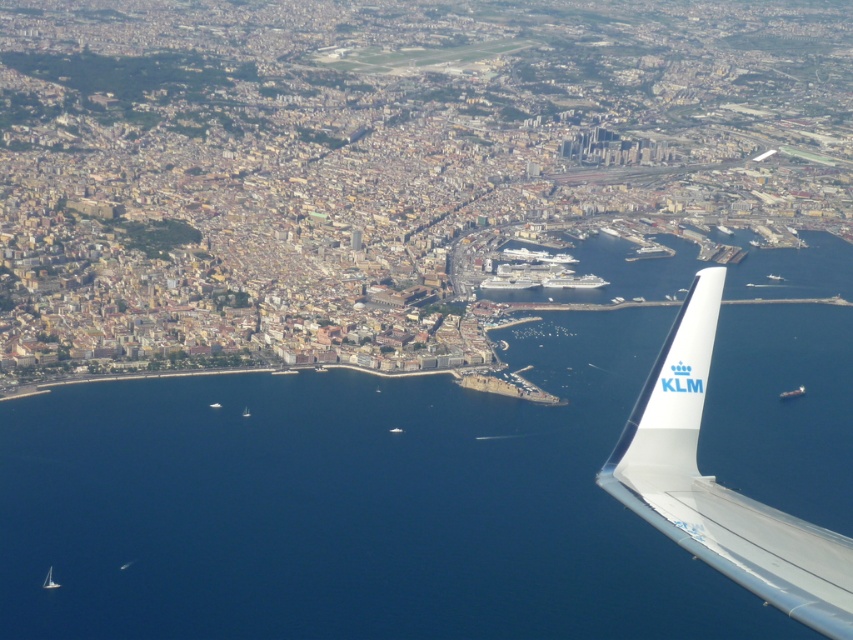
Question: Can you confirm if blue liquid water at lower left is bigger than white plastic boat at lower center?

Choices:
 (A) no
 (B) yes

Answer: (B)

Question: Among these points, which one is nearest to the camera?

Choices:
 (A) (554, 275)
 (B) (212, 404)

Answer: (A)

Question: Can you confirm if white glossy cruise ship at center is bigger than white matte sailboat at lower left?

Choices:
 (A) yes
 (B) no

Answer: (A)

Question: Among these points, which one is nearest to the camera?

Choices:
 (A) (790, 326)
 (B) (801, 392)
 (C) (213, 403)
 (D) (247, 410)

Answer: (D)

Question: Which object appears closest to the camera in this image?

Choices:
 (A) white glossy wing at lower right
 (B) white plastic boat at lower center
 (C) white plastic boat at lower left

Answer: (C)

Question: Does metallic silver boat at lower right have a larger size compared to white matte sailboat at lower left?

Choices:
 (A) yes
 (B) no

Answer: (B)